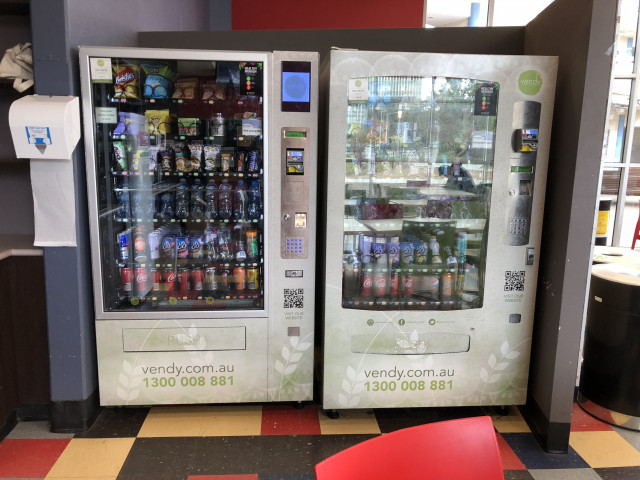
This screenshot has width=640, height=480. Identify the location of trash can. (624, 298).